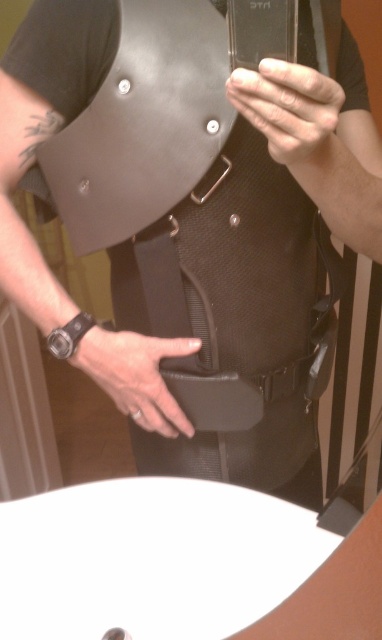
Is point (325, 125) farther from camera compared to point (153, 362)?

No, (325, 125) is in front of (153, 362).

Which of these two, smooth skin hand at upper center or leather at center, stands taller?

leather at center is taller.

Describe the element at coordinates (291, 115) in the screenshot. I see `smooth skin hand at upper center` at that location.

In order to click on smooth skin hand at upper center in this screenshot , I will do `click(291, 115)`.